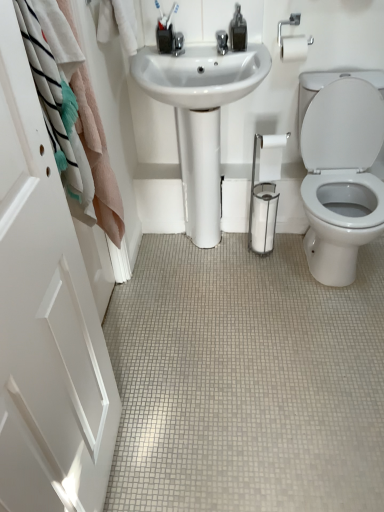
The width and height of the screenshot is (384, 512). What do you see at coordinates (45, 318) in the screenshot?
I see `white glossy door at left` at bounding box center [45, 318].

What do you see at coordinates (98, 158) in the screenshot? This screenshot has height=512, width=384. I see `white cotton towel at left` at bounding box center [98, 158].

Find the location of a particular element. The height and width of the screenshot is (512, 384). white matte toilet paper at center is located at coordinates (271, 156).

Locate an element on the screen. This screenshot has width=384, height=512. white glossy door at left is located at coordinates (45, 318).

Find the location of a particular element. The height and width of the screenshot is (512, 384). screen door in front of the white glossy sink at center is located at coordinates (45, 318).

What's the angular difference between white glossy sink at center and white glossy door at left's facing directions?

There is a 91.6-degree angle between the facing directions of white glossy sink at center and white glossy door at left.

From the picture: Is white glossy sink at center spatially inside white glossy door at left, or outside of it?

white glossy sink at center is not inside white glossy door at left, it's outside.

Is white glossy sink at center positioned far away from white matte toilet paper at center?

They are positioned close to each other.

From a real-world perspective, is white glossy sink at center positioned over white matte toilet paper at center based on gravity?

No, from a real-world perspective, white glossy sink at center is not over white matte toilet paper at center

The height and width of the screenshot is (512, 384). I want to click on screen door in front of the white tile floor at center, so click(45, 318).

Who is smaller, white glossy door at left or white tile floor at center?

white glossy door at left is smaller.

Is white glossy door at left thinner than white tile floor at center?

Yes.

Does white glossy door at left turn towards white tile floor at center?

No, white glossy door at left is not oriented towards white tile floor at center.

Which is more to the right, white matte toilet paper at center or white glossy sink at center?

white matte toilet paper at center is more to the right.

Considering the points (271, 159) and (207, 175), which point is behind, point (271, 159) or point (207, 175)?

Positioned behind is point (207, 175).

Can you confirm if white matte toilet paper at center is bigger than white glossy sink at center?

No.

Between white glossy sink at center and white tile floor at center, which one appears on the left side from the viewer's perspective?

white glossy sink at center.

Find the location of `sink that is behind the white tile floor at center`. sink that is behind the white tile floor at center is located at coordinates (200, 118).

Looking at this image, is white glossy sink at center bigger or smaller than white tile floor at center?

In the image, white glossy sink at center appears to be larger than white tile floor at center.

Between white tile floor at center and white glossy sink at center, which one is positioned behind?

white glossy sink at center is behind.

Looking at the image, does white tile floor at center seem bigger or smaller compared to white glossy sink at center?

In the image, white tile floor at center appears to be smaller than white glossy sink at center.

This screenshot has height=512, width=384. What are the coordinates of `plain in front of the white glossy sink at center` in the screenshot? It's located at (246, 380).

Who is smaller, white cotton towel at left or white tile floor at center?

white cotton towel at left is smaller.

Is white cotton towel at left in contact with white tile floor at center?

No, white cotton towel at left is not with white tile floor at center.

Does point (83, 105) lie in front of point (194, 385)?

Yes, it is.

I want to click on screen door in front of the white glossy sink at center, so click(45, 318).

In order to click on toilet paper below the white glossy sink at center (from the image's perspective) in this screenshot , I will do `click(271, 156)`.

From the image, which object appears to be nearer to white glossy sink at center, white glossy door at left or white matte toilet paper at center?

Based on the image, white matte toilet paper at center appears to be nearer to white glossy sink at center.

Which object lies nearer to the anchor point white glossy sink at center, white tile floor at center or white cotton towel at left?

Based on the image, white cotton towel at left appears to be nearer to white glossy sink at center.

From the image, which object appears to be farther from white cotton towel at left, white glossy door at left or white tile floor at center?

white tile floor at center is further to white cotton towel at left.

Looking at the image, which one is located further to white tile floor at center, white matte toilet paper at center or white glossy door at left?

Based on the image, white matte toilet paper at center appears to be further to white tile floor at center.

Considering their positions, is white tile floor at center positioned closer to white matte toilet paper at center than white glossy sink at center?

white glossy sink at center is positioned closer to the anchor white matte toilet paper at center.

From the image, which object appears to be nearer to white glossy sink at center, white tile floor at center or white matte toilet paper at center?

white matte toilet paper at center is positioned closer to the anchor white glossy sink at center.

Estimate the real-world distances between objects in this image. Which object is further from white glossy door at left, white cotton towel at left or white tile floor at center?

white tile floor at center is further to white glossy door at left.

Based on their spatial positions, is white glossy door at left or white tile floor at center closer to white matte toilet paper at center?

white tile floor at center lies closer to white matte toilet paper at center than the other object.

The height and width of the screenshot is (512, 384). In order to click on toilet paper between white glossy sink at center and white tile floor at center in the up-down direction in this screenshot , I will do click(271, 156).

This screenshot has width=384, height=512. Identify the location of plain positioned between white cotton towel at left and white matte toilet paper at center from near to far. (246, 380).

Image resolution: width=384 pixels, height=512 pixels. I want to click on bath towel between white glossy sink at center and white tile floor at center in the vertical direction, so click(x=98, y=158).

Where is `sink between white cotton towel at left and white matte toilet paper at center from front to back`? This screenshot has height=512, width=384. sink between white cotton towel at left and white matte toilet paper at center from front to back is located at coordinates (200, 118).